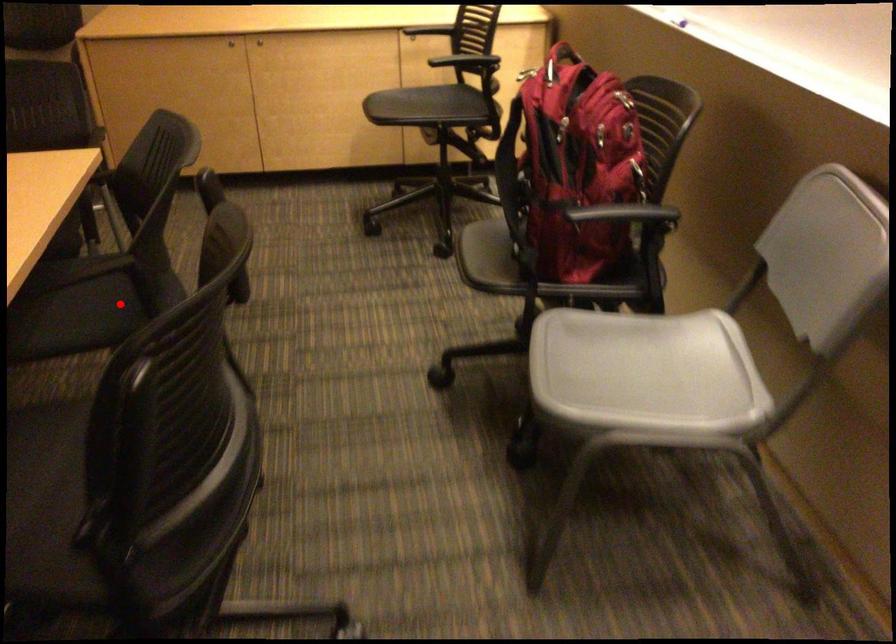
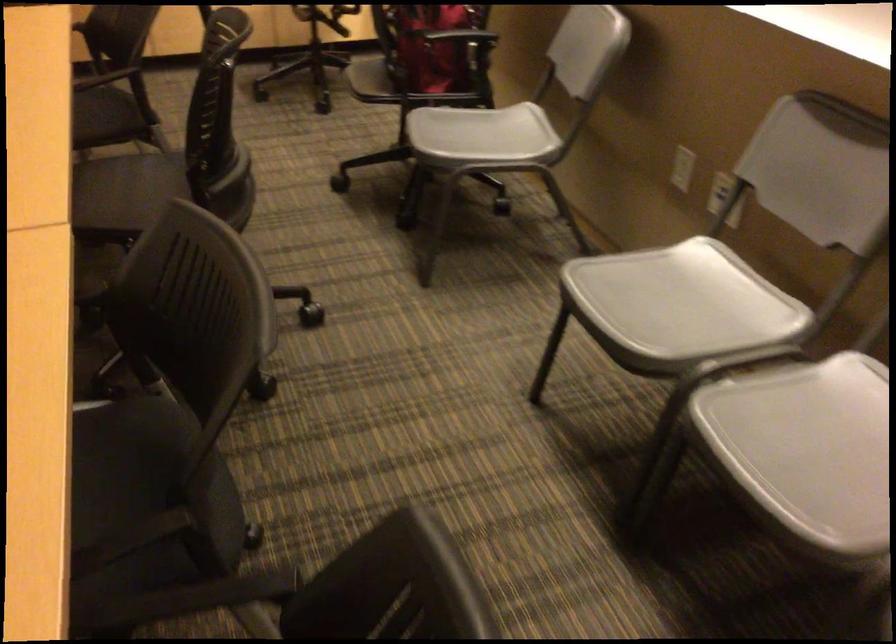
Find the pixel in the second image that matches the highlighted location in the first image.

(100, 111)